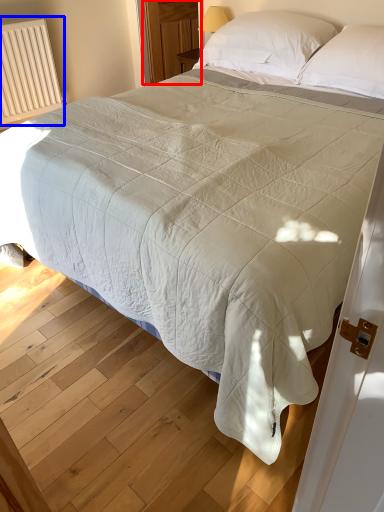
Question: Among these objects, which one is nearest to the camera, glass door (highlighted by a red box) or radiator (highlighted by a blue box)?

Choices:
 (A) glass door
 (B) radiator

Answer: (B)